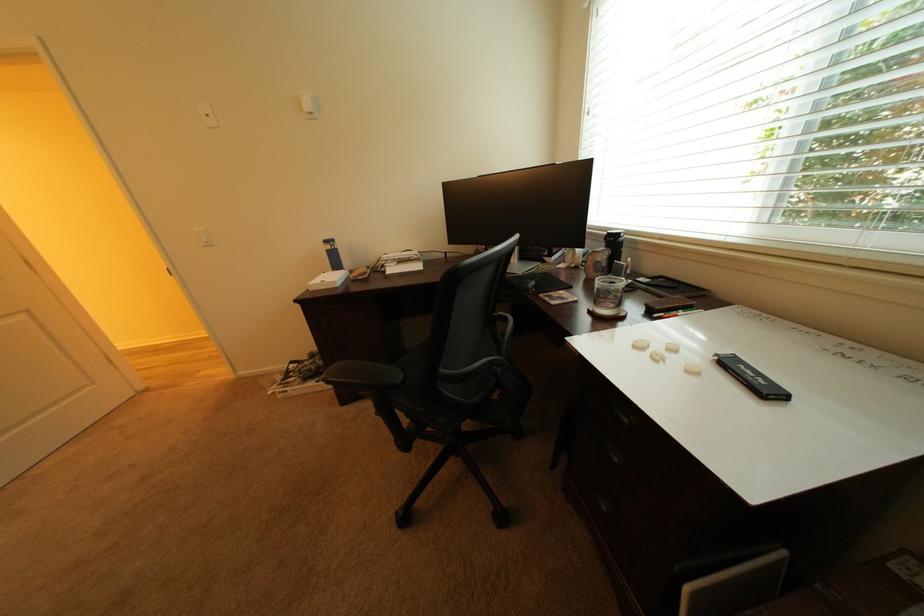
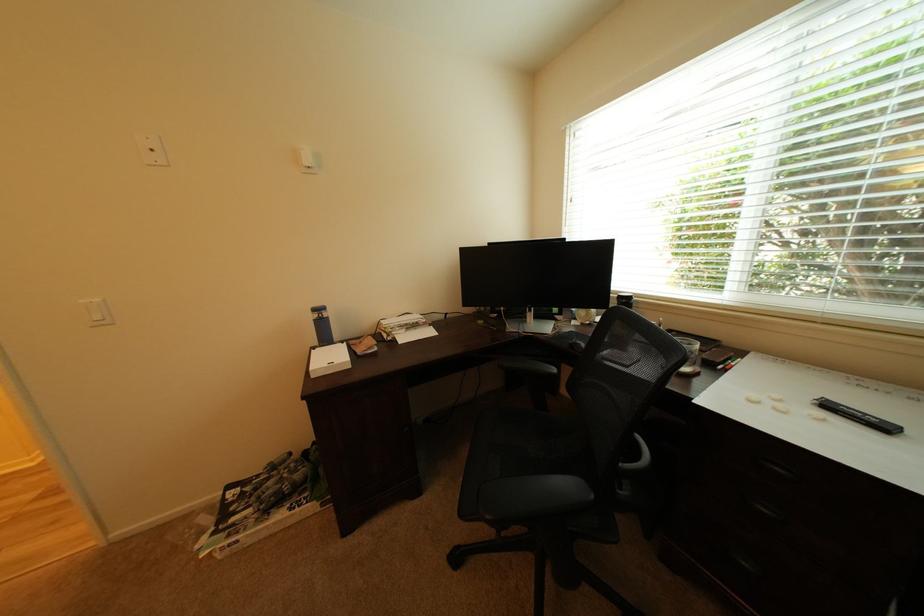
Locate, in the second image, the point that corresponds to pixel 297 392 in the first image.

(248, 543)